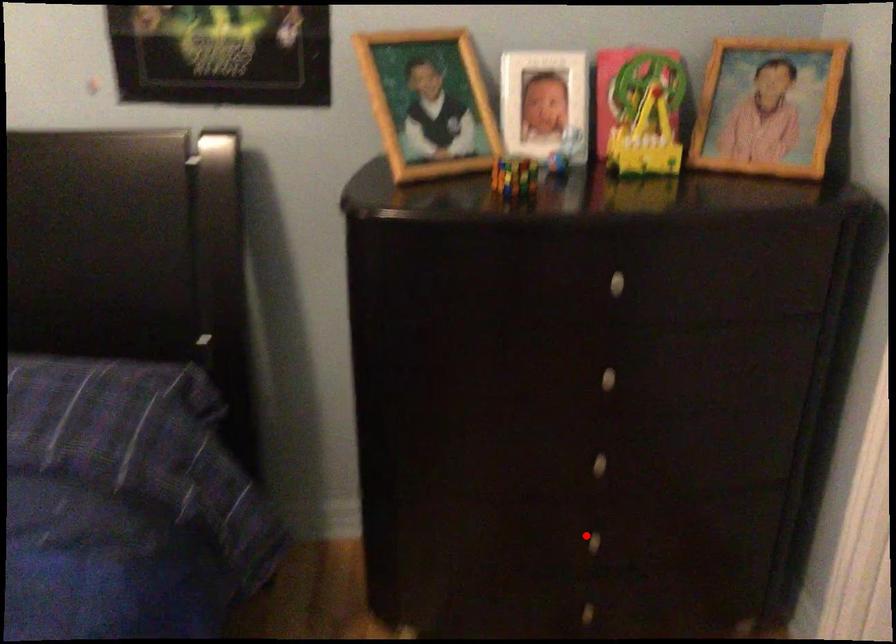
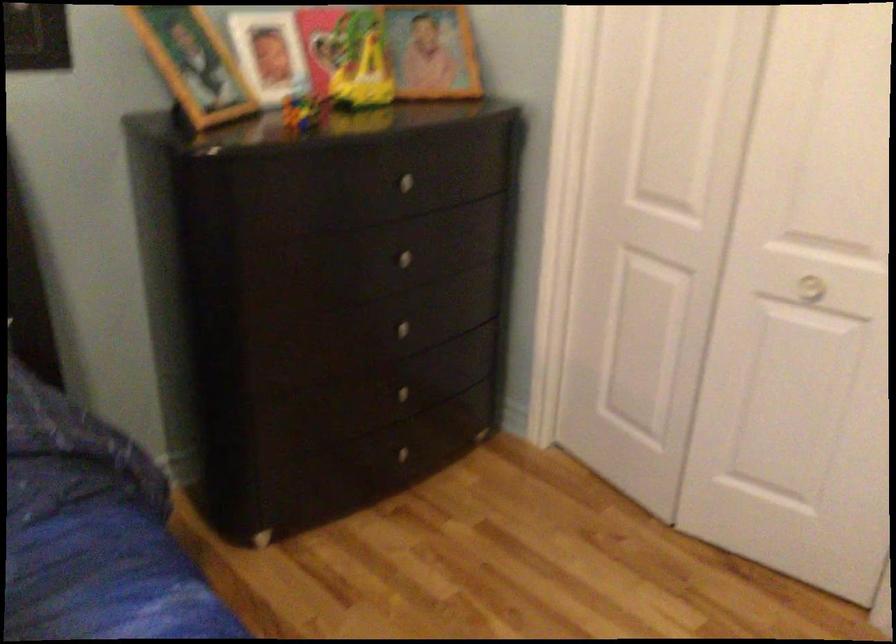
Question: I am providing you with two images of the same scene from different viewpoints. In image1, a red point is highlighted. Considering the same 3D point in image2, which of the following is correct?

Choices:
 (A) It is closer
 (B) It is farther

Answer: (B)